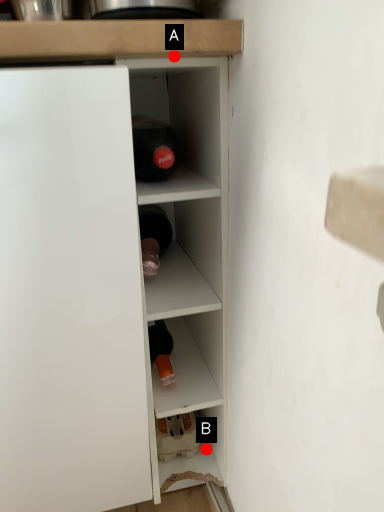
Question: Two points are circled on the image, labeled by A and B beside each circle. Among these points, which one is nearest to the camera?

Choices:
 (A) A is closer
 (B) B is closer

Answer: (A)